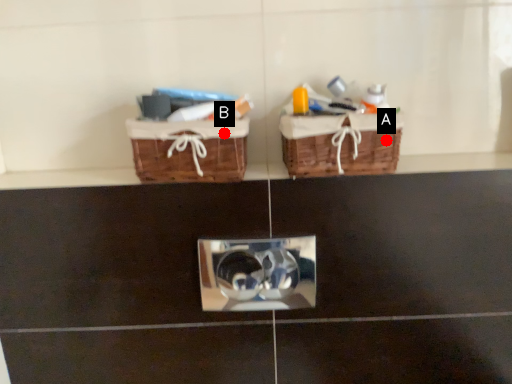
Question: Two points are circled on the image, labeled by A and B beside each circle. Which of the following is the closest to the observer?

Choices:
 (A) A is closer
 (B) B is closer

Answer: (B)